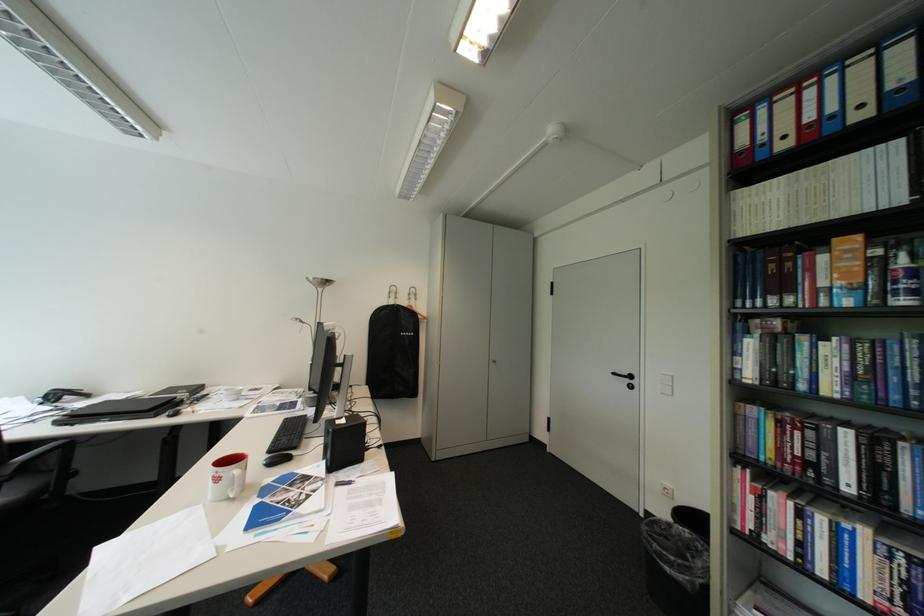
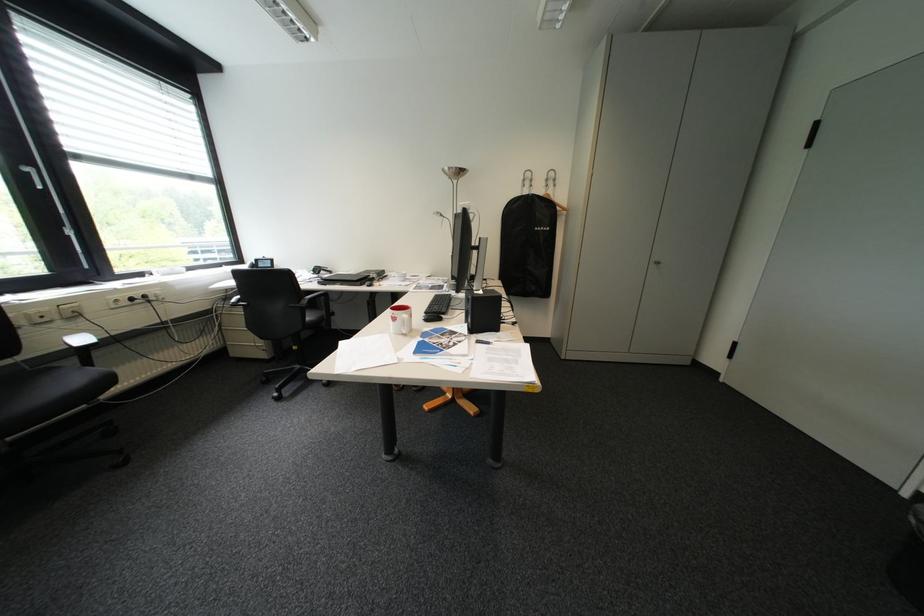
Find the pixel in the second image that matches point (344, 468) in the first image.

(484, 331)